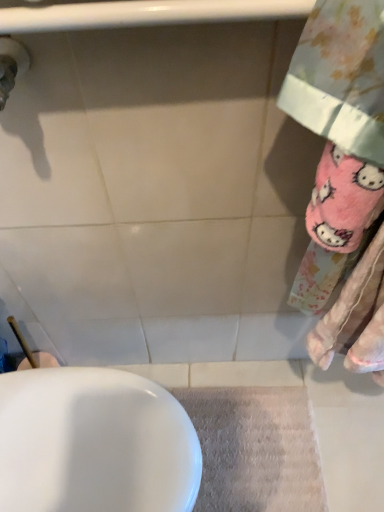
Identify the location of beige textured bath mat at lower center. (255, 449).

What do you see at coordinates (255, 449) in the screenshot? I see `beige textured bath mat at lower center` at bounding box center [255, 449].

In the scene shown: Measure the distance between point (201, 428) and camera.

Point (201, 428) is 1.19 meters from camera.

The image size is (384, 512). What do you see at coordinates (94, 443) in the screenshot?
I see `white glossy sink at lower left` at bounding box center [94, 443].

Where is `white glossy sink at lower left`? This screenshot has width=384, height=512. white glossy sink at lower left is located at coordinates (94, 443).

Where is `beige textured bath mat at lower center`? beige textured bath mat at lower center is located at coordinates (255, 449).

Considering the positions of objects beige textured bath mat at lower center and white glossy sink at lower left in the image provided, who is more to the left, beige textured bath mat at lower center or white glossy sink at lower left?

Positioned to the left is white glossy sink at lower left.

Is beige textured bath mat at lower center closer to camera compared to white glossy sink at lower left?

No, it is not.

Between point (307, 457) and point (125, 381), which one is positioned behind?

The point (307, 457) is behind.

From the image's perspective, which is below, beige textured bath mat at lower center or white glossy sink at lower left?

beige textured bath mat at lower center is shown below in the image.

From a real-world perspective, is beige textured bath mat at lower center over white glossy sink at lower left?

No.

Looking at their sizes, would you say beige textured bath mat at lower center is wider or thinner than white glossy sink at lower left?

Clearly, beige textured bath mat at lower center has less width compared to white glossy sink at lower left.

Who is taller, beige textured bath mat at lower center or white glossy sink at lower left?

Standing taller between the two is white glossy sink at lower left.

Is beige textured bath mat at lower center bigger or smaller than white glossy sink at lower left?

Clearly, beige textured bath mat at lower center is smaller in size than white glossy sink at lower left.

Is beige textured bath mat at lower center positioned beyond the bounds of white glossy sink at lower left?

Yes, beige textured bath mat at lower center is not within white glossy sink at lower left.

Is beige textured bath mat at lower center not near white glossy sink at lower left?

That's not correct — beige textured bath mat at lower center is a little close to white glossy sink at lower left.

Is white glossy sink at lower left at the back of beige textured bath mat at lower center?

Absolutely, beige textured bath mat at lower center is directed away from white glossy sink at lower left.

What's the angular difference between beige textured bath mat at lower center and white glossy sink at lower left's facing directions?

They differ by 0.000381 degrees in their facing directions.

Measure the distance from beige textured bath mat at lower center to white glossy sink at lower left.

beige textured bath mat at lower center is 17.00 inches from white glossy sink at lower left.

Where is `sink in front of the beige textured bath mat at lower center`? The image size is (384, 512). sink in front of the beige textured bath mat at lower center is located at coordinates (94, 443).

Is white glossy sink at lower left to the left of beige textured bath mat at lower center from the viewer's perspective?

Indeed, white glossy sink at lower left is positioned on the left side of beige textured bath mat at lower center.

Is the position of white glossy sink at lower left less distant than that of beige textured bath mat at lower center?

Yes, white glossy sink at lower left is closer to the camera.

Considering the positions of points (48, 498) and (199, 426), is point (48, 498) closer to camera compared to point (199, 426)?

Yes.

From the image's perspective, which object appears higher, white glossy sink at lower left or beige textured bath mat at lower center?

From the image's view, white glossy sink at lower left is above.

Looking at this image, from a real-world perspective, is white glossy sink at lower left beneath beige textured bath mat at lower center?

No.

From the picture: Is white glossy sink at lower left wider or thinner than beige textured bath mat at lower center?

In the image, white glossy sink at lower left appears to be wider than beige textured bath mat at lower center.

From their relative heights in the image, would you say white glossy sink at lower left is taller or shorter than beige textured bath mat at lower center?

white glossy sink at lower left is taller than beige textured bath mat at lower center.

Between white glossy sink at lower left and beige textured bath mat at lower center, which one has larger size?

Bigger between the two is white glossy sink at lower left.

Is white glossy sink at lower left completely or partially outside of beige textured bath mat at lower center?

That's correct, white glossy sink at lower left is outside of beige textured bath mat at lower center.

Is white glossy sink at lower left far away from beige textured bath mat at lower center?

No, there isn't a large distance between white glossy sink at lower left and beige textured bath mat at lower center.

Is white glossy sink at lower left positioned with its back to beige textured bath mat at lower center?

No, white glossy sink at lower left is not facing the opposite direction of beige textured bath mat at lower center.

I want to click on bath mat behind the white glossy sink at lower left, so click(255, 449).

In the image, there is a white glossy sink at lower left. Where is `bath mat below it (from a real-world perspective)`? The width and height of the screenshot is (384, 512). bath mat below it (from a real-world perspective) is located at coordinates (255, 449).

This screenshot has width=384, height=512. In order to click on sink in front of the beige textured bath mat at lower center in this screenshot , I will do `click(94, 443)`.